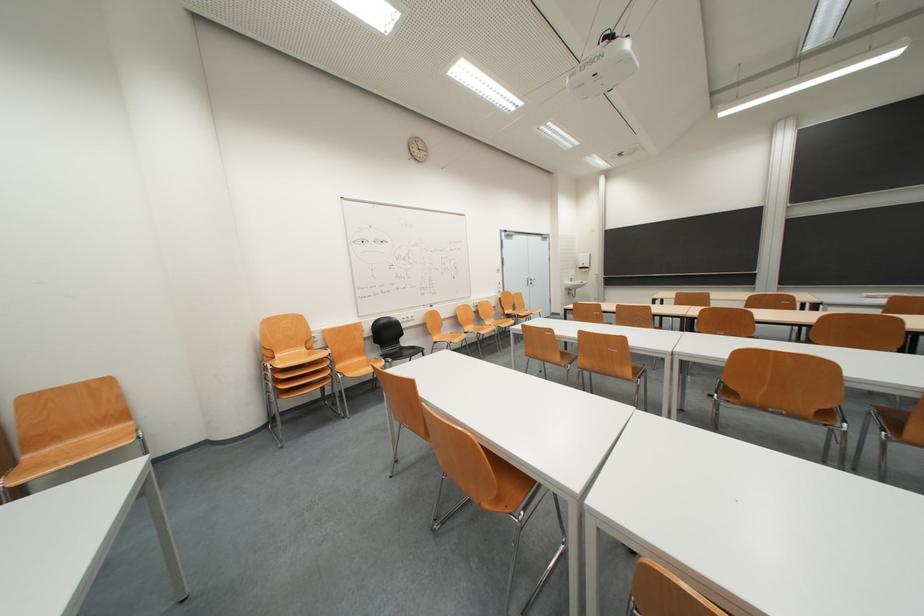
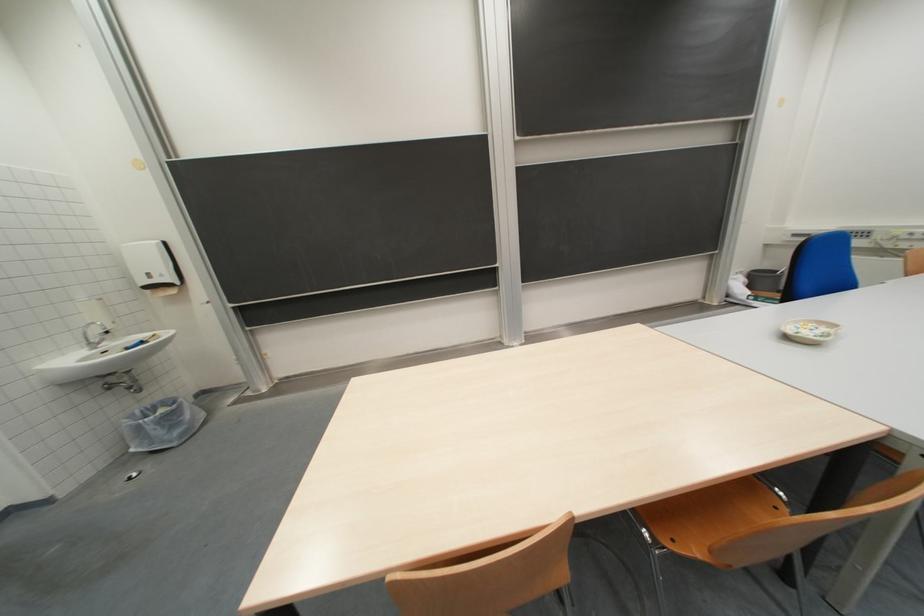
Where in the second image is the point corresponding to the point at 584,270 from the first image?

(136, 284)